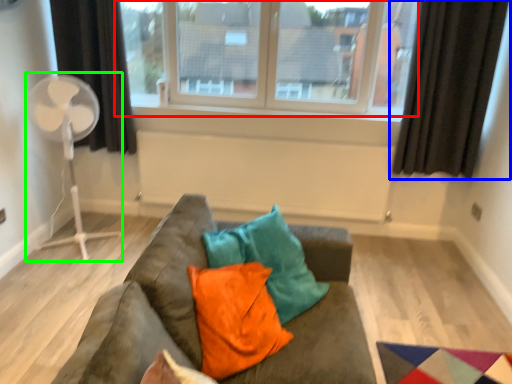
Question: Which is farther away from window (highlighted by a red box)? curtain (highlighted by a blue box) or fan (highlighted by a green box)?

Choices:
 (A) curtain
 (B) fan

Answer: (B)